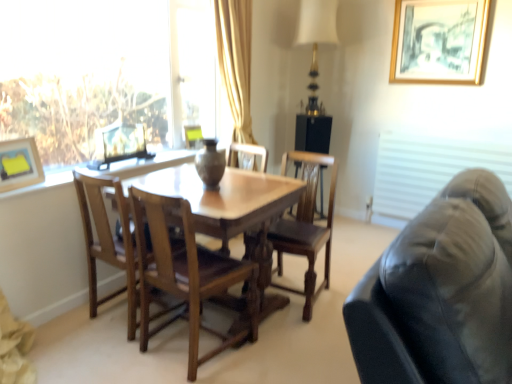
Image resolution: width=512 pixels, height=384 pixels. What are the coordinates of `unoccupied region to the right of matte brown vase at center` in the screenshot? It's located at (247, 185).